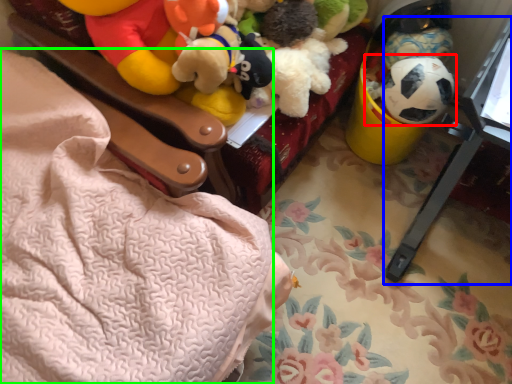
Question: Based on their relative distances, which object is farther from toy (highlighted by a red box)? Choose from changing table (highlighted by a blue box) and blanket (highlighted by a green box).

Choices:
 (A) changing table
 (B) blanket

Answer: (B)